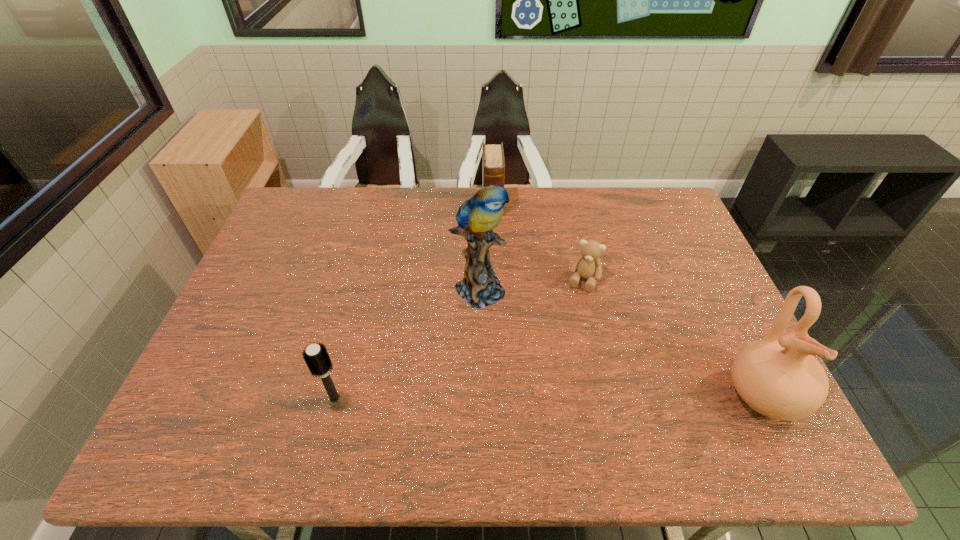
Find the location of `free space on the desktop that is between the leftmost object and the rightmost object and is positioned on the face of the parrot`. free space on the desktop that is between the leftmost object and the rightmost object and is positioned on the face of the parrot is located at coordinates (611, 396).

Locate an element on the screen. This screenshot has width=960, height=540. vacant space on the desktop that is between the leftmost object and the second tallest object and is positioned on the front-facing side of the shortest object is located at coordinates (541, 397).

I want to click on vacant space on the desktop that is between the hairbrush and the pottery and is positioned on the spine side of the farthest object, so click(x=503, y=397).